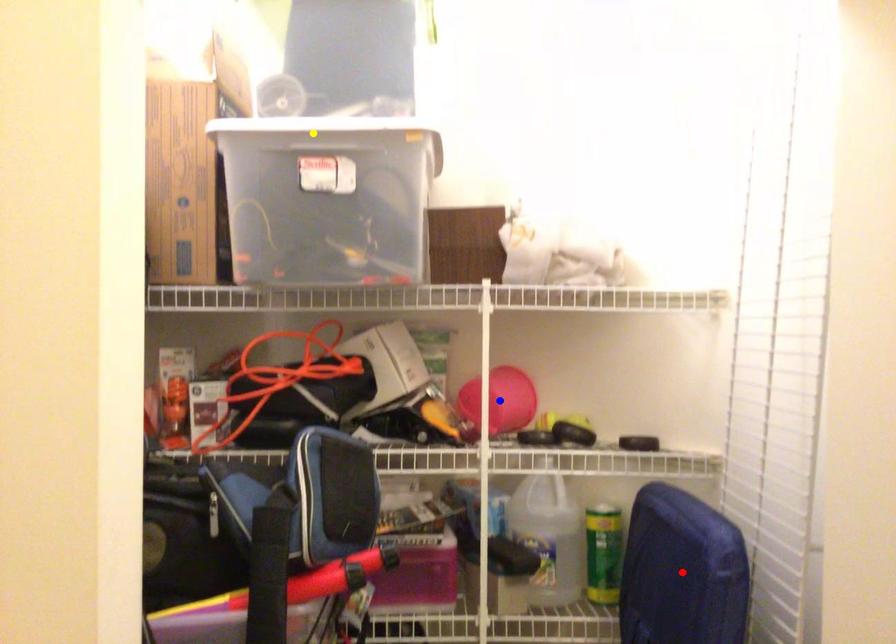
Order these from nearest to farthest:
red point
blue point
yellow point

blue point
yellow point
red point